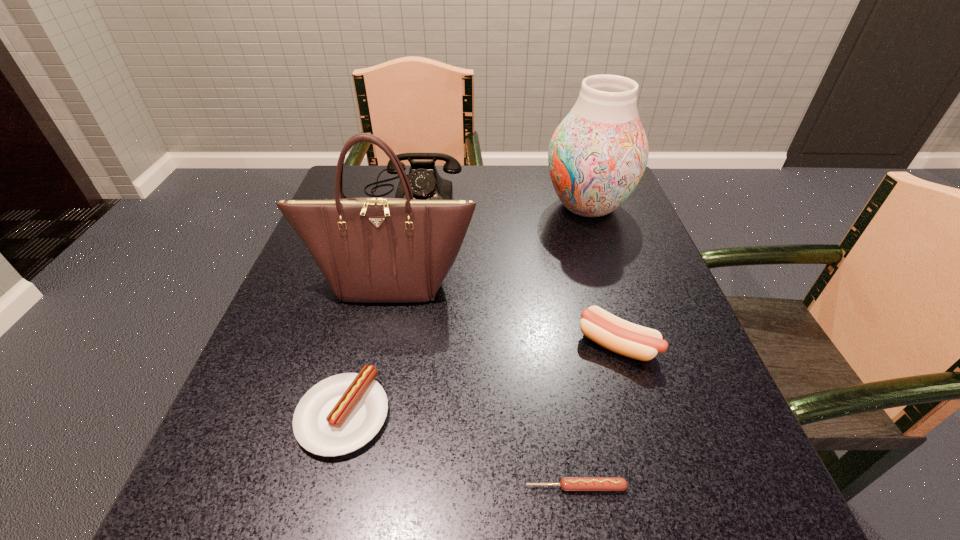
Find the location of a particular element. The width and height of the screenshot is (960, 540). sausage that is the closest to the vase is located at coordinates (625, 338).

Locate an element on the screen. Image resolution: width=960 pixels, height=540 pixels. sausage that stands as the second closest to the vase is located at coordinates (342, 413).

Where is `vacant space that satisfies the following two spatial constraints: 1. on the front-facing side of the fourth nearest object; 2. on the left side of the farthest sausage`? This screenshot has width=960, height=540. vacant space that satisfies the following two spatial constraints: 1. on the front-facing side of the fourth nearest object; 2. on the left side of the farthest sausage is located at coordinates (377, 344).

You are a GUI agent. You are given a task and a screenshot of the screen. Output one action in this format:
    pyautogui.click(x=<x>, y=<y>)
    Task: Click on the vacant space that satisfies the following two spatial constraints: 1. on the front face of the vase; 2. on the left side of the fourth shortest object
    
    Given the screenshot: What is the action you would take?
    pyautogui.click(x=410, y=206)